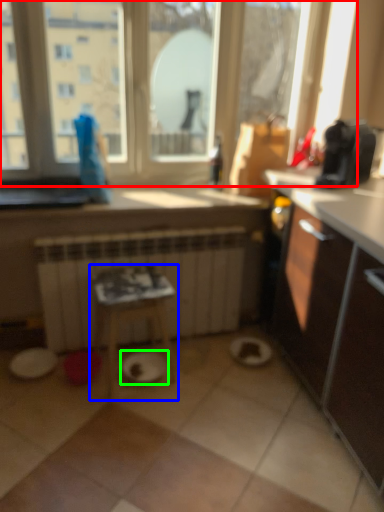
Question: Which is nearer to the window (highlighted by a red box)? table (highlighted by a blue box) or paper plate (highlighted by a green box).

Choices:
 (A) table
 (B) paper plate

Answer: (A)